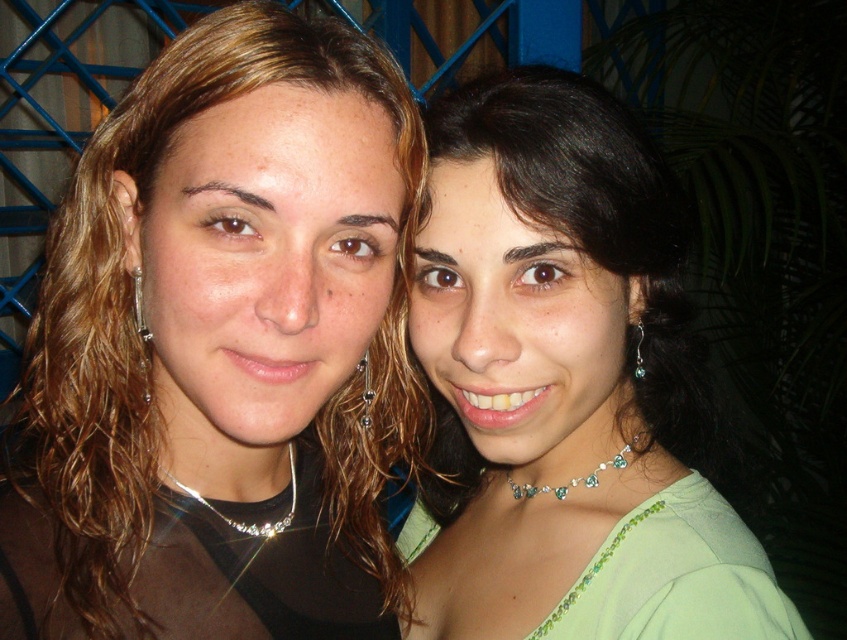
Who is taller, brown shiny hair at center or silver metallic earring at left?

brown shiny hair at center

Does brown shiny hair at center appear under silver metallic earring at left?

Indeed, brown shiny hair at center is positioned under silver metallic earring at left.

Between point (386, 563) and point (136, 268), which one is positioned behind?

The point (386, 563) is more distant.

This screenshot has width=847, height=640. Identify the location of brown shiny hair at center. (220, 349).

Which of these two, green fabric shirt at right or emerald crystal necklace at center, stands shorter?

Standing shorter between the two is emerald crystal necklace at center.

Is green fabric shirt at right to the left of emerald crystal necklace at center from the viewer's perspective?

In fact, green fabric shirt at right is to the right of emerald crystal necklace at center.

The height and width of the screenshot is (640, 847). Identify the location of green fabric shirt at right. (563, 385).

Between point (364, 371) and point (140, 273), which one is positioned in front?

Point (140, 273) is in front.

Does silver metallic earring at center appear under silver metallic earring at left?

Correct, silver metallic earring at center is located below silver metallic earring at left.

Find the location of a particular element. This screenshot has height=640, width=847. silver metallic earring at center is located at coordinates (364, 392).

I want to click on silver metallic earring at center, so click(x=364, y=392).